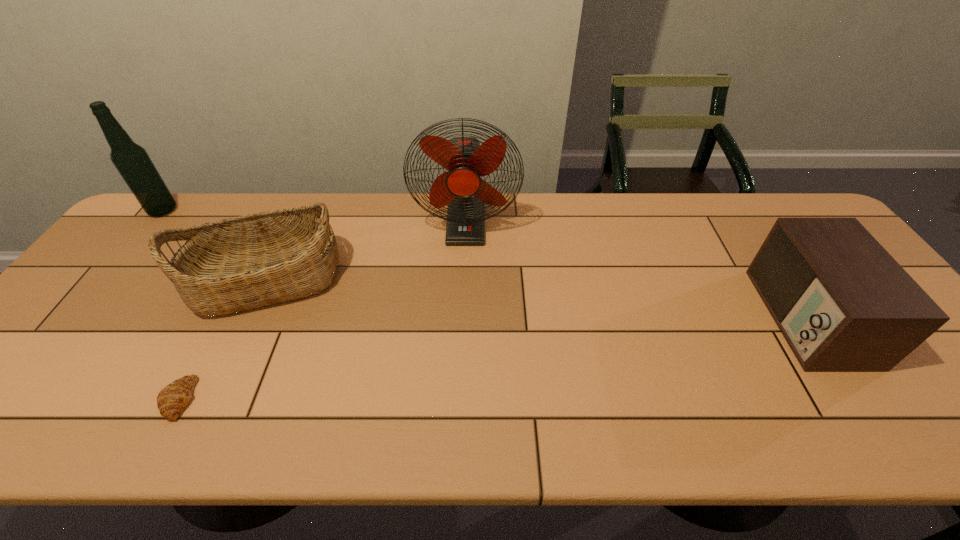
You are a GUI agent. You are given a task and a screenshot of the screen. Output one action in this format:
    pyautogui.click(x=<x>, y=<y>)
    Task: Click on the vacant space at the near edge of the desktop
    The width and height of the screenshot is (960, 540).
    Given the screenshot: What is the action you would take?
    pyautogui.click(x=874, y=420)

This screenshot has width=960, height=540. Find the location of `vacant region at the far right corner of the desktop`. vacant region at the far right corner of the desktop is located at coordinates (771, 195).

Where is `free area in between the leftmost object and the rightmost object`? free area in between the leftmost object and the rightmost object is located at coordinates (485, 264).

Identify the location of vacant area between the rightmost object and the alcohol. (485, 264).

The height and width of the screenshot is (540, 960). Find the location of `unoccupied position between the radio receiver and the basket`. unoccupied position between the radio receiver and the basket is located at coordinates (537, 298).

What are the coordinates of `free space between the nearest object and the basket` in the screenshot? It's located at (224, 339).

This screenshot has height=540, width=960. In order to click on vacant area between the shortest object and the fan in this screenshot , I will do `click(323, 312)`.

Find the location of a particular element. The width and height of the screenshot is (960, 540). vacant space that's between the fan and the radio receiver is located at coordinates (636, 271).

Where is `unoccupied area between the crescent roll and the alcohol`? Image resolution: width=960 pixels, height=540 pixels. unoccupied area between the crescent roll and the alcohol is located at coordinates (172, 305).

This screenshot has width=960, height=540. I want to click on free space between the crescent roll and the fan, so (x=323, y=312).